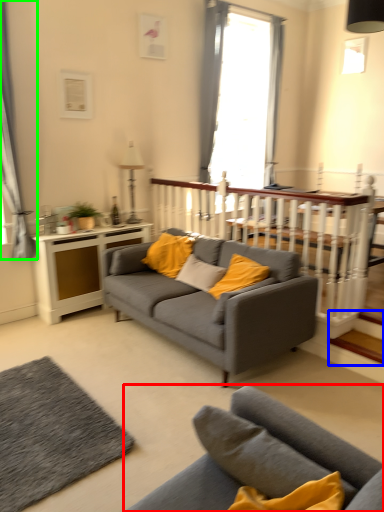
Question: Which object is the farthest from studio couch (highlighted by a red box)? Choose among these: stairwell (highlighted by a blue box) or curtain (highlighted by a green box).

Choices:
 (A) stairwell
 (B) curtain

Answer: (B)